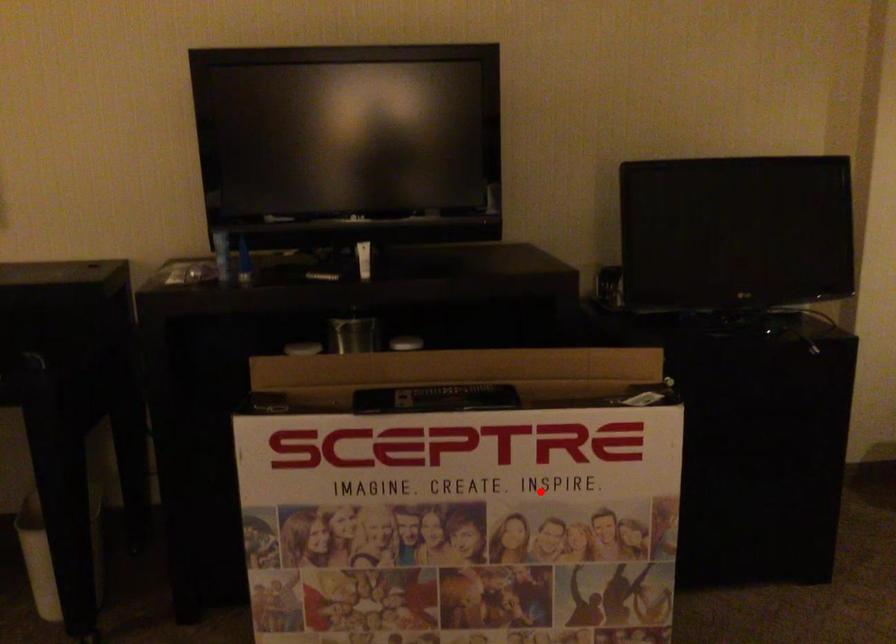
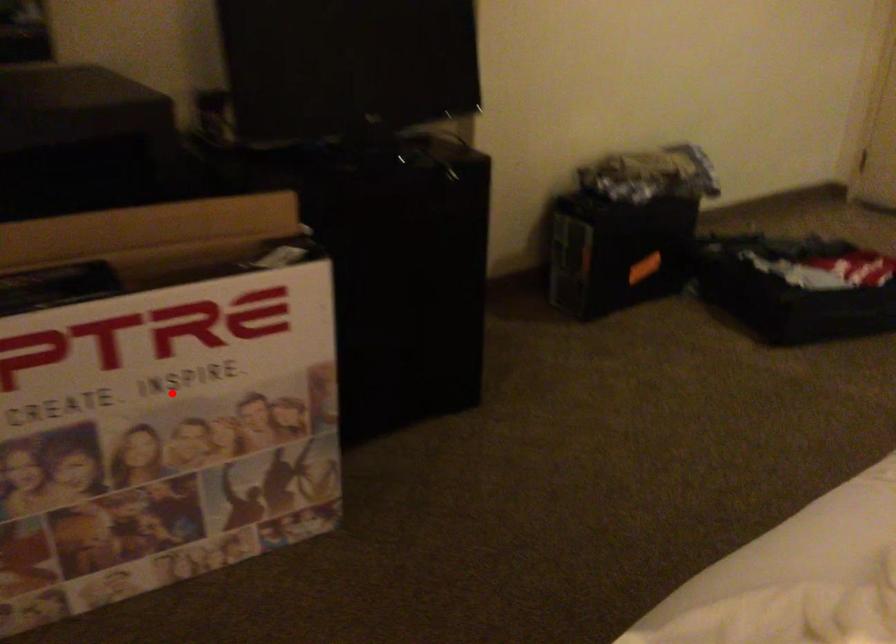
I am providing you with two images of the same scene from different viewpoints. A red point is marked on the first image and another point is marked on the second image. Does the point marked in image1 correspond to the same location as the one in image2?

Yes